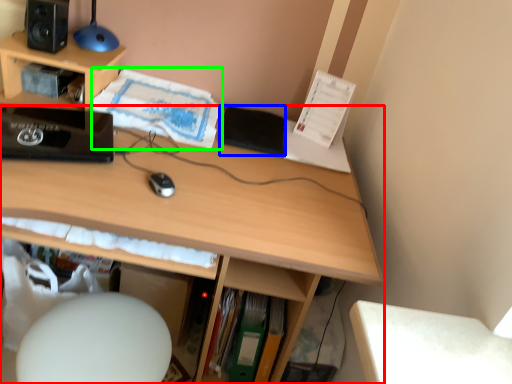
Question: Which object is positioned closest to desk (highlighted by a red box)? Select from notepad (highlighted by a blue box) and book (highlighted by a green box).

Choices:
 (A) notepad
 (B) book

Answer: (B)